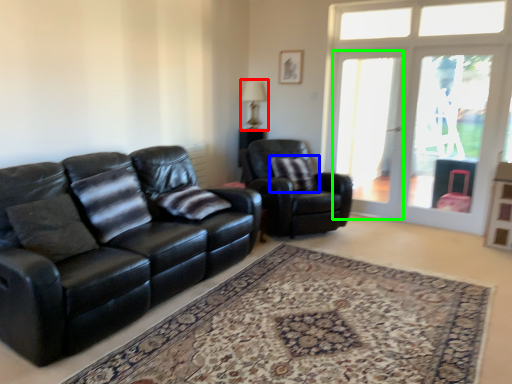
Question: Estimate the real-world distances between objects in this image. Which object is farther from lamp (highlighted by a red box), pillow (highlighted by a blue box) or screen door (highlighted by a green box)?

Choices:
 (A) pillow
 (B) screen door

Answer: (B)